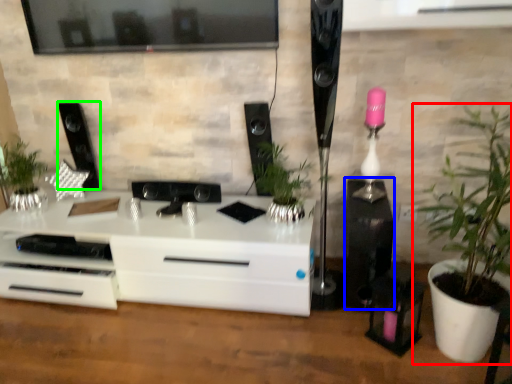
Question: Estimate the real-world distances between objects in this image. Which object is closer to houseplant (highlighted by a red box), speaker (highlighted by a blue box) or speaker (highlighted by a green box)?

Choices:
 (A) speaker
 (B) speaker

Answer: (A)